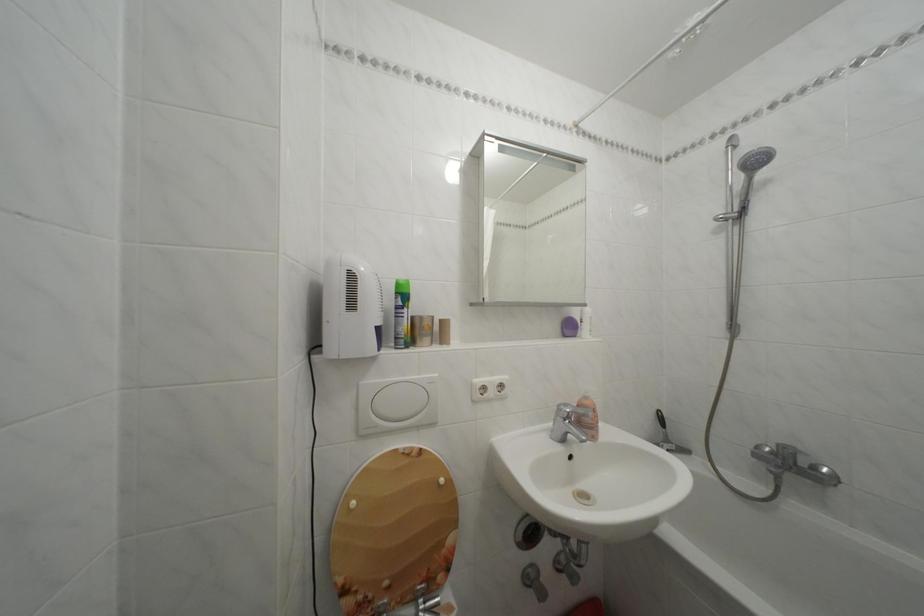
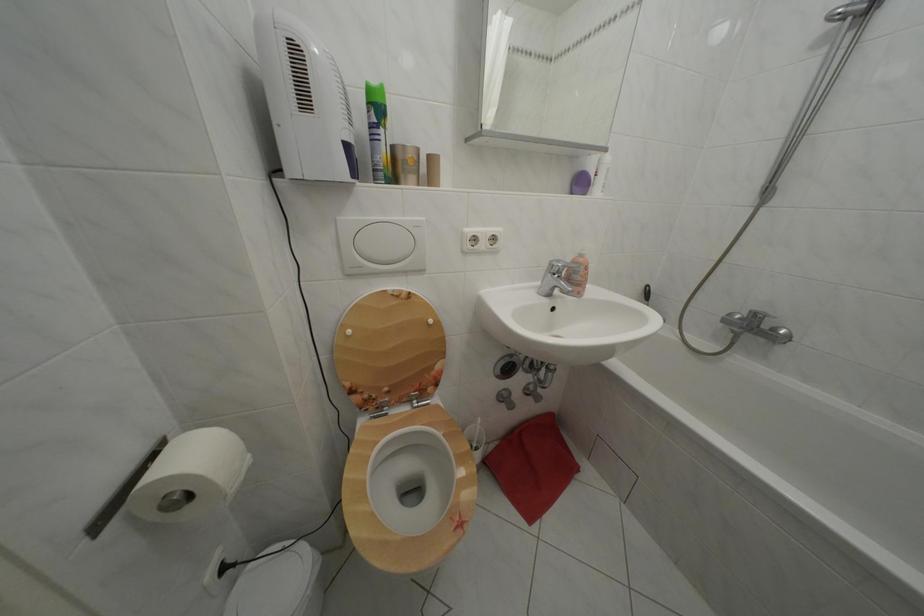
The point at (575, 411) is marked in the first image. Where is the corresponding point in the second image?

(567, 268)